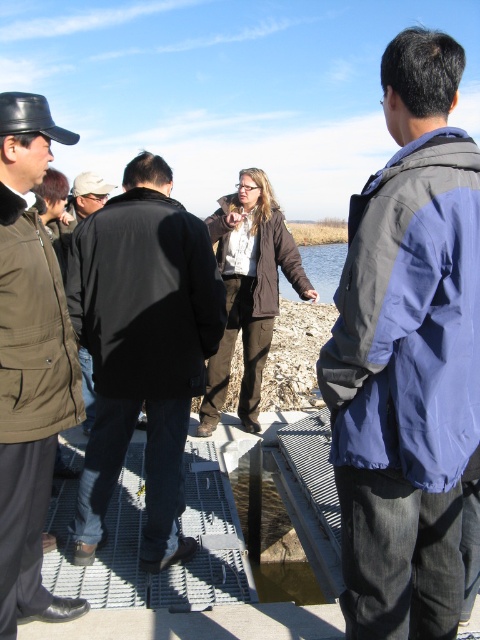
Question: Observing the image, what is the correct spatial positioning of blue fabric jacket at upper right in reference to matte black hat at left?

Choices:
 (A) below
 (B) above

Answer: (B)

Question: Among these points, which one is farthest from the camera?

Choices:
 (A) (143, 563)
 (B) (25, 397)

Answer: (A)

Question: Which object is farther from the camera taking this photo?

Choices:
 (A) matte black hat at left
 (B) black matte jacket at center

Answer: (B)

Question: Estimate the real-world distances between objects in this image. Which object is farther from the black matte jacket at center?

Choices:
 (A) blue fabric jacket at upper right
 (B) matte black hat at left
 (C) clear water at center

Answer: (C)

Question: Does blue fabric jacket at upper right have a greater width compared to clear water at center?

Choices:
 (A) no
 (B) yes

Answer: (A)

Question: Can you confirm if black matte jacket at center is positioned to the left of matte black hat at left?

Choices:
 (A) yes
 (B) no

Answer: (B)